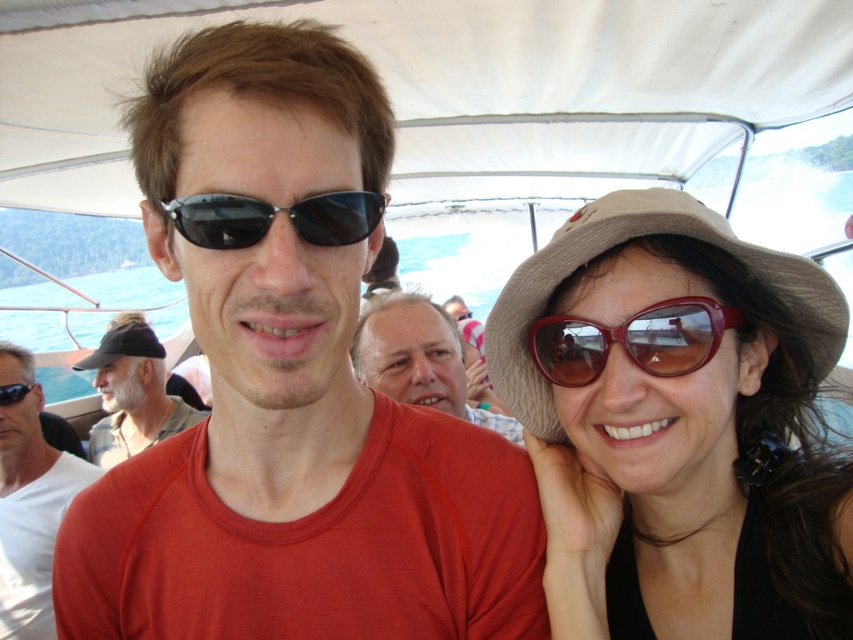
Question: Does matte black sunglasses at center appear on the right side of black metallic sunglasses at upper center?

Choices:
 (A) no
 (B) yes

Answer: (A)

Question: Among these points, which one is farthest from the camera?

Choices:
 (A) (1, 353)
 (B) (154, 353)
 (C) (535, 340)
 (D) (19, 387)

Answer: (B)

Question: Is matte black sunglasses at center above brown matte sunglasses at center?

Choices:
 (A) no
 (B) yes

Answer: (A)

Question: Considering the real-world distances, which object is farthest from the black metallic sunglasses at upper center?

Choices:
 (A) matte black goggles at upper left
 (B) gray fabric cap at center
 (C) matte black sunglasses at center
 (D) brown matte sunglasses at center

Answer: (B)

Question: Is brown matte hat at upper right wider than gray fabric cap at center?

Choices:
 (A) no
 (B) yes

Answer: (A)

Question: Which point is closer to the camera?

Choices:
 (A) matte black sunglasses at center
 (B) matte black goggles at upper left
 (C) black fabric cap at left

Answer: (A)